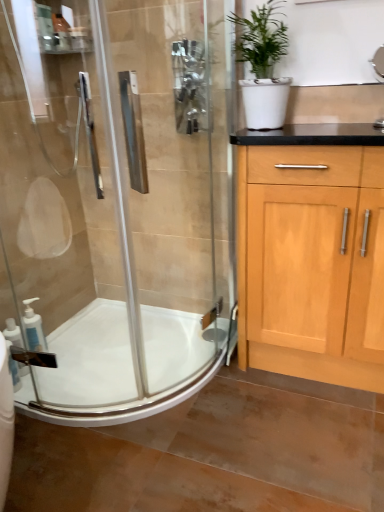
Question: From the image's perspective, is clear glass shower door at left under white glossy soap dispenser at lower left, the second soap dispenser in the back-to-front sequence?

Choices:
 (A) yes
 (B) no

Answer: (B)

Question: Is clear glass shower door at left thinner than white glossy soap dispenser at lower left, the second soap dispenser in the back-to-front sequence?

Choices:
 (A) no
 (B) yes

Answer: (A)

Question: Can white glossy soap dispenser at lower left, placed as the 1th soap dispenser when sorted from front to back, be found inside clear glass shower door at left?

Choices:
 (A) yes
 (B) no

Answer: (A)

Question: Can you confirm if clear glass shower door at left is positioned to the right of white glossy soap dispenser at lower left, the second soap dispenser in the back-to-front sequence?

Choices:
 (A) no
 (B) yes

Answer: (B)

Question: Does clear glass shower door at left come in front of white glossy soap dispenser at lower left, placed as the 1th soap dispenser when sorted from front to back?

Choices:
 (A) no
 (B) yes

Answer: (B)

Question: Considering the positions of white matte pot at upper right and white glossy soap dispenser at lower left, the second soap dispenser in the back-to-front sequence, in the image, is white matte pot at upper right bigger or smaller than white glossy soap dispenser at lower left, the second soap dispenser in the back-to-front sequence,?

Choices:
 (A) small
 (B) big

Answer: (B)

Question: Looking at their shapes, would you say white matte pot at upper right is wider or thinner than white glossy soap dispenser at lower left, placed as the 1th soap dispenser when sorted from front to back?

Choices:
 (A) wide
 (B) thin

Answer: (A)

Question: From the image's perspective, is white matte pot at upper right above or below white glossy soap dispenser at lower left, the second soap dispenser in the back-to-front sequence?

Choices:
 (A) above
 (B) below

Answer: (A)

Question: In terms of height, does white matte pot at upper right look taller or shorter compared to white glossy soap dispenser at lower left, placed as the 1th soap dispenser when sorted from front to back?

Choices:
 (A) tall
 (B) short

Answer: (A)

Question: Based on their positions, is white glossy sink at upper right located to the left or right of white matte pot at upper right?

Choices:
 (A) left
 (B) right

Answer: (B)

Question: Is white glossy sink at upper right taller or shorter than white matte pot at upper right?

Choices:
 (A) tall
 (B) short

Answer: (B)

Question: From the image's perspective, relative to white matte pot at upper right, is white glossy sink at upper right above or below?

Choices:
 (A) below
 (B) above

Answer: (A)

Question: Is white glossy sink at upper right bigger or smaller than white matte pot at upper right?

Choices:
 (A) big
 (B) small

Answer: (B)

Question: In terms of size, does white matte soap dispenser at lower left, the 2th soap dispenser from the front, appear bigger or smaller than white glossy soap dispenser at lower left, placed as the 1th soap dispenser when sorted from front to back?

Choices:
 (A) small
 (B) big

Answer: (B)

Question: In terms of height, does white matte soap dispenser at lower left, the 1th soap dispenser positioned from the back, look taller or shorter compared to white glossy soap dispenser at lower left, the second soap dispenser in the back-to-front sequence?

Choices:
 (A) tall
 (B) short

Answer: (A)